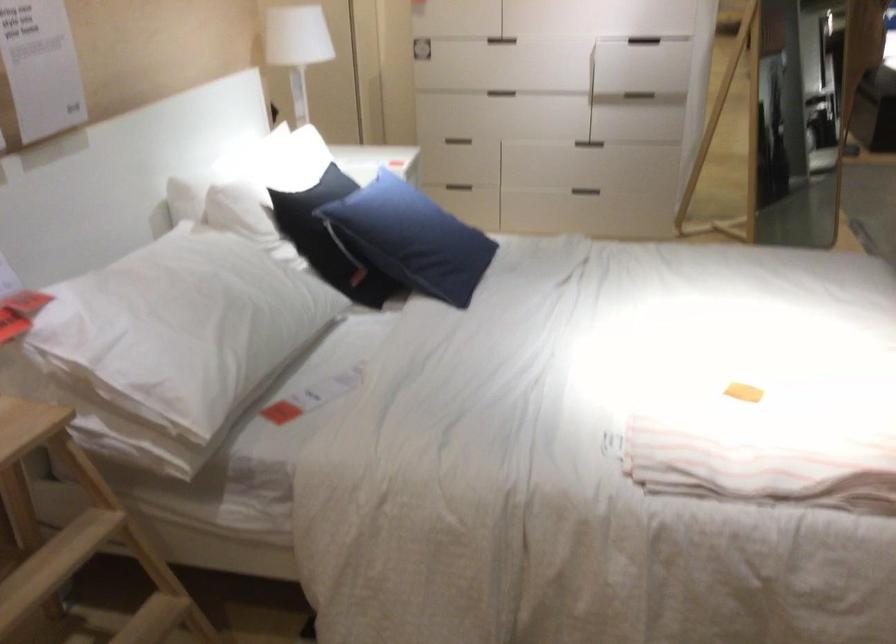
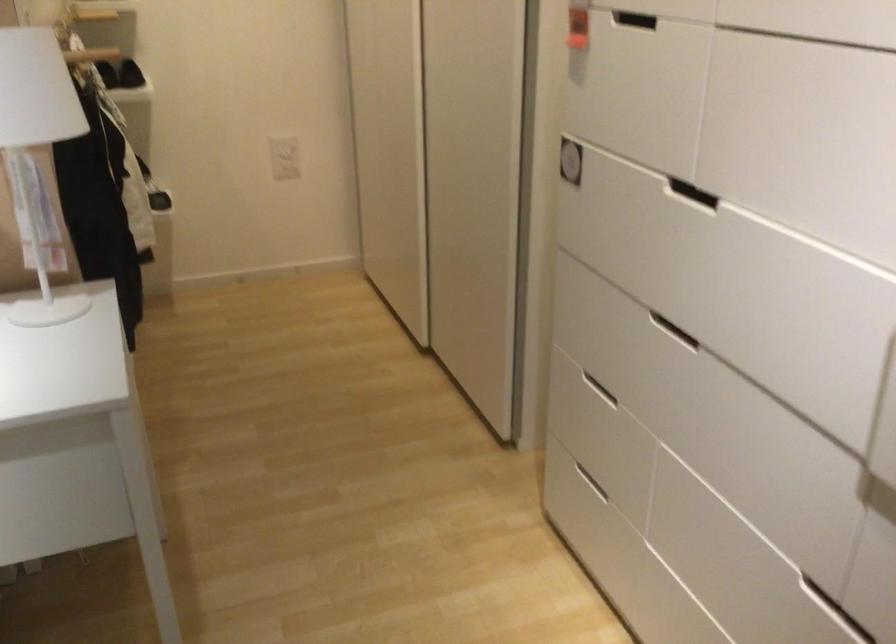
The point at (x=471, y=131) is marked in the first image. Where is the corresponding point in the second image?

(586, 379)